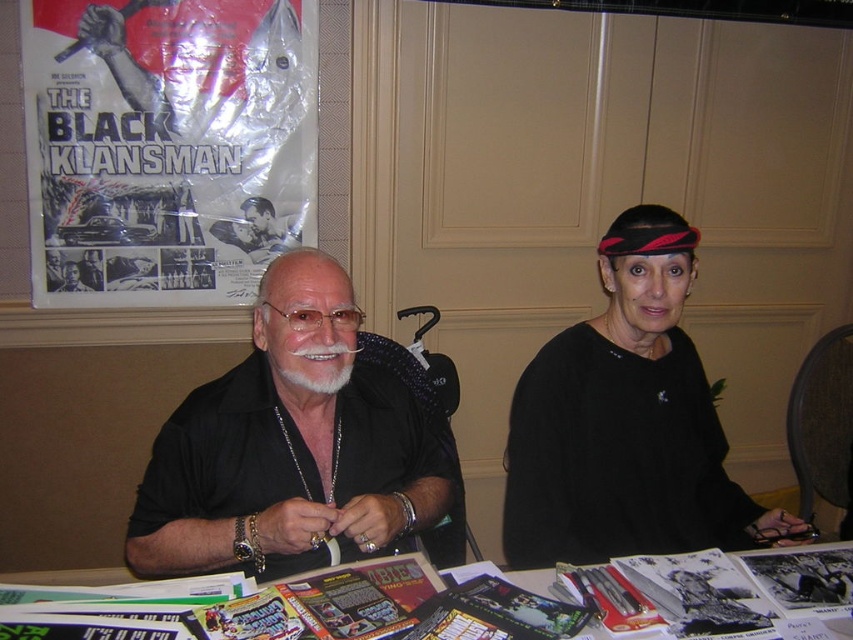
Question: Can you confirm if matte plastic poster at upper left is positioned to the left of shiny plastic magazine at center?

Choices:
 (A) yes
 (B) no

Answer: (A)

Question: Which point is farther to the camera?

Choices:
 (A) black matte headband at upper right
 (B) matte plastic poster at upper left

Answer: (B)

Question: Which of these objects is positioned closest to the black matte shirt at center?

Choices:
 (A) black matte shirt at left
 (B) shiny plastic magazine at center

Answer: (A)

Question: Among these points, which one is nearest to the camera?

Choices:
 (A) (129, 528)
 (B) (236, 118)
 (C) (618, 518)

Answer: (A)

Question: Does black matte shirt at center appear over shiny plastic magazine at center?

Choices:
 (A) no
 (B) yes

Answer: (B)

Question: Is black matte shirt at left to the right of shiny plastic magazine at center from the viewer's perspective?

Choices:
 (A) no
 (B) yes

Answer: (A)